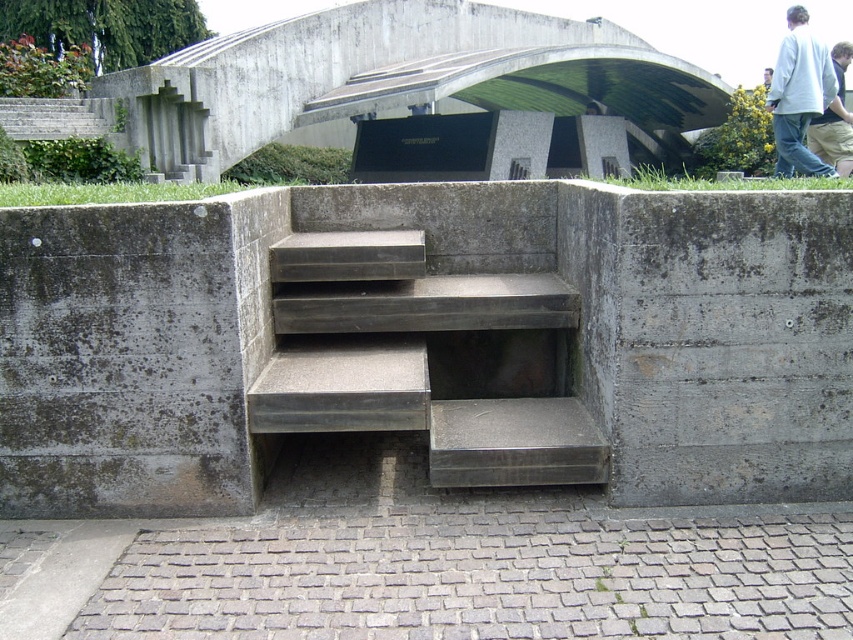
Question: Among these objects, which one is farthest from the camera?

Choices:
 (A) light blue jeans at upper right
 (B) white cotton shirt at upper right
 (C) gray concrete stairs at center

Answer: (A)

Question: Does gray concrete stairs at center appear over light blue jeans at upper right?

Choices:
 (A) yes
 (B) no

Answer: (B)

Question: Which object is farther from the camera taking this photo?

Choices:
 (A) gray concrete stairs at center
 (B) light blue jeans at upper right
 (C) white cotton shirt at upper right

Answer: (B)

Question: Does gray concrete stairs at center appear on the left side of light blue jeans at upper right?

Choices:
 (A) no
 (B) yes

Answer: (B)

Question: Is gray concrete stairs at center thinner than white cotton shirt at upper right?

Choices:
 (A) no
 (B) yes

Answer: (B)

Question: Which of the following is the closest to the observer?

Choices:
 (A) white cotton shirt at upper right
 (B) gray concrete stairs at center
 (C) light blue jeans at upper right

Answer: (B)